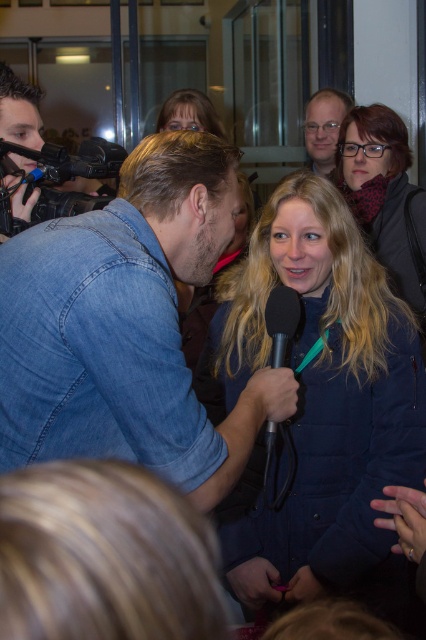
You are a photographer at the event and need to position your equipment. You have the black plastic video camera at upper left and the black matte microphone at center. Which object is wider?

The black plastic video camera at upper left is wider than the black matte microphone at center since its width surpasses the microphone.

You are a fashion designer observing an event. You notice the denim jacket at center and the matte black jacket at upper right. Which jacket has a longer length?

The matte black jacket at upper right has a longer length than the denim jacket at center.

Based on the photo, you are a photographer at the event and need to position your camera to capture the interaction between the man and the woman holding the microphone. The black plastic video camera at upper left is already placed at coordinates 0.273, 0.157. If your camera has a standard field of view, will it be able to frame both the man and the woman in the shot?

The black plastic video camera at upper left is positioned at coordinates (66, 173). Since the man and woman are in the foreground and the camera is placed at the upper left corner, it might struggle to capture both subjects fully within the frame unless adjusted. However, without specific field of view details, it is difficult to confirm.